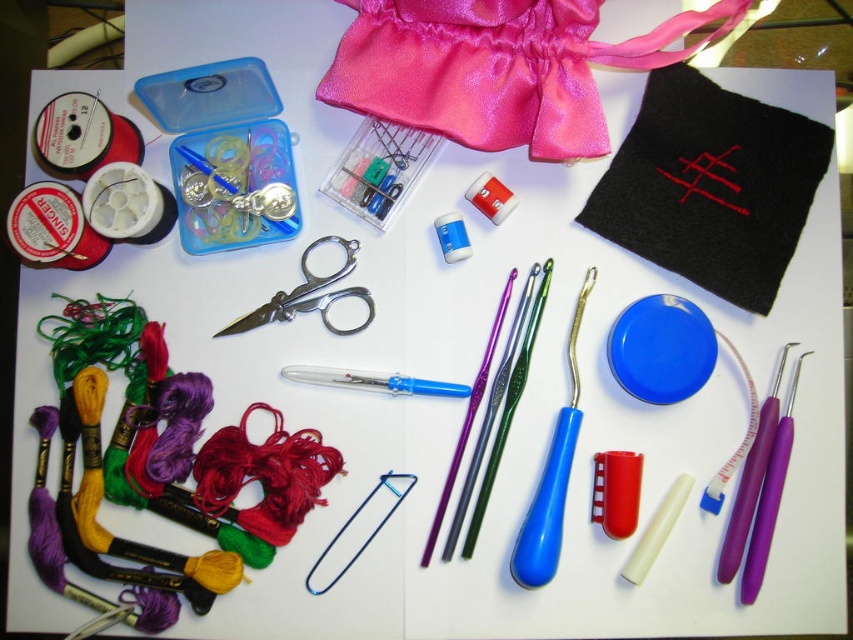
Does shiny pink fabric at upper center have a greater width compared to metallic scissors at center?

Correct, the width of shiny pink fabric at upper center exceeds that of metallic scissors at center.

What do you see at coordinates (498, 68) in the screenshot?
I see `shiny pink fabric at upper center` at bounding box center [498, 68].

Identify the location of shiny pink fabric at upper center. (498, 68).

Is metallic silver crochet hook at center above metallic scissors at center?

Incorrect, metallic silver crochet hook at center is not positioned above metallic scissors at center.

Is point (328, 564) closer to camera compared to point (306, 260)?

That is True.

Is point (341, 568) more distant than point (345, 244)?

No, it is not.

This screenshot has height=640, width=853. I want to click on metallic silver crochet hook at center, so click(x=358, y=531).

Is point (550, 45) closer to camera compared to point (407, 474)?

Yes, point (550, 45) is closer to viewer.

Does shiny pink fabric at upper center have a greater height compared to metallic silver crochet hook at center?

Correct, shiny pink fabric at upper center is much taller as metallic silver crochet hook at center.

Describe the element at coordinates (498, 68) in the screenshot. I see `shiny pink fabric at upper center` at that location.

This screenshot has height=640, width=853. I want to click on shiny pink fabric at upper center, so click(498, 68).